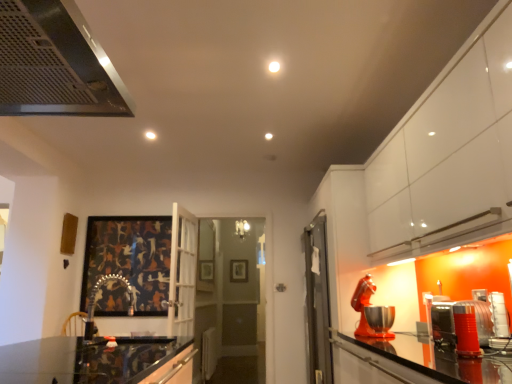
Question: Is dark matte painting at center, the first picture frame when ordered from top to bottom, facing away from rubberized orange blender at right, the first appliance positioned from the front?

Choices:
 (A) no
 (B) yes

Answer: (A)

Question: Does dark matte painting at center, which appears as the 2th picture frame when ordered from the bottom, lie in front of rubberized orange blender at right, placed as the fourth appliance when sorted from back to front?

Choices:
 (A) no
 (B) yes

Answer: (A)

Question: Is dark matte painting at center, which appears as the 2th picture frame when ordered from the bottom, at the right side of rubberized orange blender at right, placed as the fourth appliance when sorted from back to front?

Choices:
 (A) no
 (B) yes

Answer: (A)

Question: From the image's perspective, is dark matte painting at center, which appears as the 2th picture frame when ordered from the bottom, located beneath rubberized orange blender at right, placed as the fourth appliance when sorted from back to front?

Choices:
 (A) no
 (B) yes

Answer: (B)

Question: Is dark matte painting at center, which appears as the 2th picture frame when ordered from the bottom, not inside rubberized orange blender at right, the first appliance positioned from the front?

Choices:
 (A) no
 (B) yes

Answer: (B)

Question: From a real-world perspective, relative to dark matte painting at center, the first picture frame when ordered from top to bottom, is shiny metallic mixer at right, marked as the third appliance in a front-to-back arrangement, vertically above or below?

Choices:
 (A) above
 (B) below

Answer: (B)

Question: Is shiny metallic mixer at right, marked as the third appliance in a front-to-back arrangement, spatially inside dark matte painting at center, which appears as the 2th picture frame when ordered from the bottom, or outside of it?

Choices:
 (A) inside
 (B) outside

Answer: (B)

Question: Is shiny metallic mixer at right, placed as the second appliance when sorted from back to front, in front of or behind dark matte painting at center, which appears as the 1th picture frame when viewed from the left, in the image?

Choices:
 (A) front
 (B) behind

Answer: (A)

Question: From the image's perspective, relative to dark matte painting at center, which appears as the 2th picture frame when ordered from the bottom, is shiny metallic mixer at right, marked as the third appliance in a front-to-back arrangement, above or below?

Choices:
 (A) above
 (B) below

Answer: (A)

Question: Visually, is metallic silver toaster at right, positioned as the 1th appliance in back-to-front order, positioned to the left or to the right of dark matte painting at center, which appears as the 2th picture frame when ordered from the bottom?

Choices:
 (A) left
 (B) right

Answer: (B)

Question: Is point (425, 317) closer or farther from the camera than point (151, 283)?

Choices:
 (A) farther
 (B) closer

Answer: (B)

Question: Is metallic silver toaster at right, positioned as the 1th appliance in back-to-front order, spatially inside dark matte painting at center, positioned as the first picture frame in front-to-back order, or outside of it?

Choices:
 (A) outside
 (B) inside

Answer: (A)

Question: Relative to dark matte painting at center, acting as the 2th picture frame starting from the right, is metallic silver toaster at right, positioned as the 1th appliance in back-to-front order, in front or behind?

Choices:
 (A) front
 (B) behind

Answer: (A)

Question: From the image's perspective, is wooden picture frame at center, placed as the 1th picture frame when sorted from bottom to top, positioned above or below dark matte painting at center, acting as the 2th picture frame starting from the right?

Choices:
 (A) above
 (B) below

Answer: (B)

Question: Do you think wooden picture frame at center, which ranks as the 2th picture frame in top-to-bottom order, is within dark matte painting at center, the second picture frame from the back, or outside of it?

Choices:
 (A) inside
 (B) outside

Answer: (B)